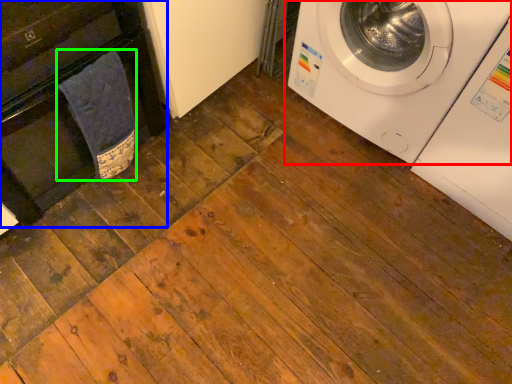
Question: Estimate the real-world distances between objects in this image. Which object is closer to washing machine (highlighted by a red box), dish washer (highlighted by a blue box) or material (highlighted by a green box)?

Choices:
 (A) dish washer
 (B) material

Answer: (B)